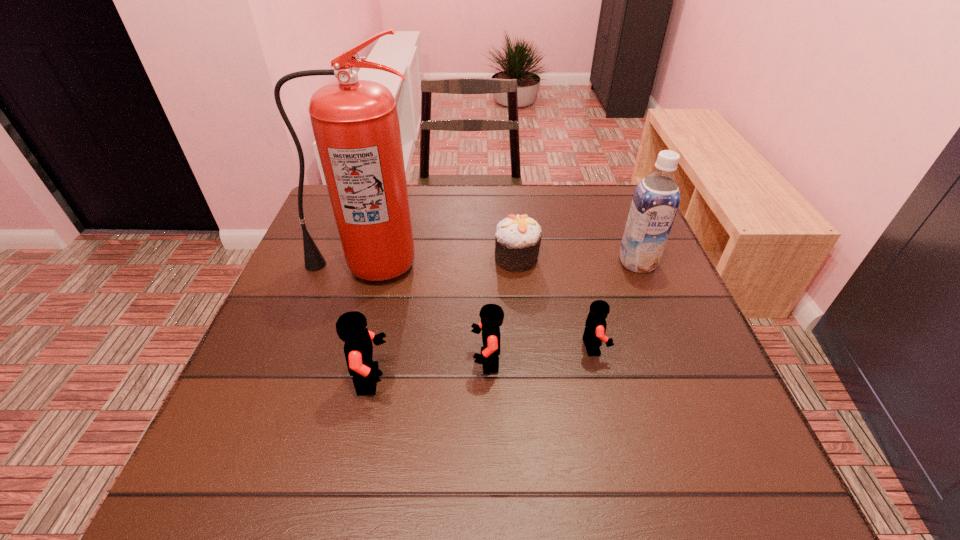
The width and height of the screenshot is (960, 540). What are the coordinates of `free region located 0.390m on the front-facing side of the third shortest object` in the screenshot? It's located at (273, 362).

Find the location of a particular element. The height and width of the screenshot is (540, 960). free space located 0.200m on the front-facing side of the third shortest object is located at coordinates coord(369,362).

In order to click on free space located on the front-facing side of the third shortest object in this screenshot , I will do `click(390, 362)`.

You are a GUI agent. You are given a task and a screenshot of the screen. Output one action in this format:
    pyautogui.click(x=<x>, y=<y>)
    Task: Click on the vacant space located on the front-facing side of the shortest Lego
    
    Given the screenshot: What is the action you would take?
    pyautogui.click(x=656, y=346)

The image size is (960, 540). Find the location of `vacant space located on the instruction side of the tallest object`. vacant space located on the instruction side of the tallest object is located at coordinates (337, 361).

Locate an element on the screen. This screenshot has width=960, height=540. vacant space situated 0.380m on the label of the rightmost object is located at coordinates (701, 417).

Find the location of a particular element. Image resolution: width=960 pixels, height=540 pixels. vacant space located on the front of the cupcake is located at coordinates (527, 369).

Where is `object situated at the near edge`? This screenshot has width=960, height=540. object situated at the near edge is located at coordinates (351, 327).

Where is `object that is at the left edge`? This screenshot has width=960, height=540. object that is at the left edge is located at coordinates (355, 123).

I want to click on object present at the right edge, so click(x=656, y=199).